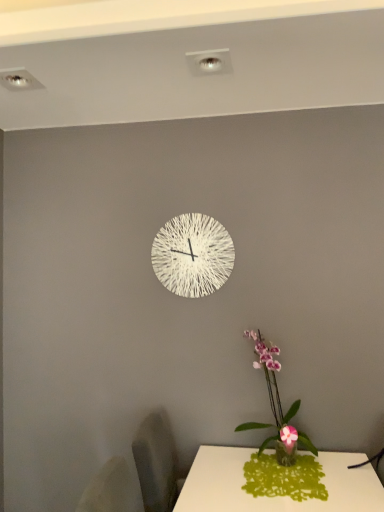
Question: Does white textured clock at center have a lesser width compared to pink orchid at lower right?

Choices:
 (A) no
 (B) yes

Answer: (B)

Question: Is the surface of white textured clock at center in direct contact with pink orchid at lower right?

Choices:
 (A) yes
 (B) no

Answer: (B)

Question: Is white textured clock at center bigger than pink orchid at lower right?

Choices:
 (A) no
 (B) yes

Answer: (A)

Question: Is white textured clock at center smaller than pink orchid at lower right?

Choices:
 (A) yes
 (B) no

Answer: (A)

Question: Is white textured clock at center closer to the viewer compared to pink orchid at lower right?

Choices:
 (A) no
 (B) yes

Answer: (A)

Question: Is white textured clock at center to the right of pink orchid at lower right from the viewer's perspective?

Choices:
 (A) yes
 (B) no

Answer: (B)

Question: Considering the relative positions of pink orchid at lower right and white textured clock at center in the image provided, is pink orchid at lower right to the right of white textured clock at center from the viewer's perspective?

Choices:
 (A) yes
 (B) no

Answer: (A)

Question: From the image's perspective, is pink orchid at lower right below white textured clock at center?

Choices:
 (A) no
 (B) yes

Answer: (B)

Question: Can you confirm if pink orchid at lower right is smaller than white textured clock at center?

Choices:
 (A) yes
 (B) no

Answer: (B)

Question: Is pink orchid at lower right not near white textured clock at center?

Choices:
 (A) no
 (B) yes

Answer: (A)

Question: Is pink orchid at lower right wider than white textured clock at center?

Choices:
 (A) yes
 (B) no

Answer: (A)

Question: Is the position of pink orchid at lower right more distant than that of white textured clock at center?

Choices:
 (A) yes
 (B) no

Answer: (B)

Question: Considering their positions, is pink orchid at lower right located in front of or behind white textured clock at center?

Choices:
 (A) front
 (B) behind

Answer: (A)